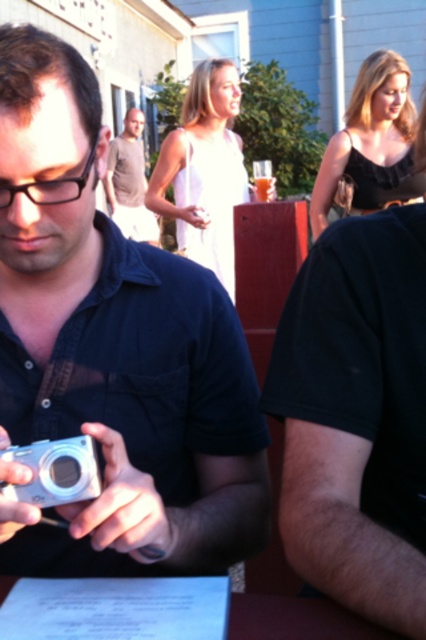
You are a photographer trying to set up your equipment. You have a silver metallic camera at left and a light brown shirt at center. Which object is located to the right of the other?

The silver metallic camera at left is positioned on the right side of light brown shirt at center, meaning the camera is to the right of the shirt.